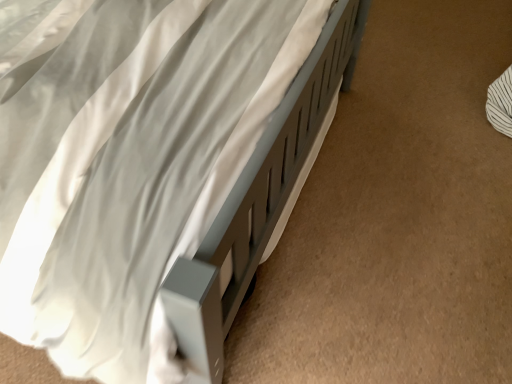
The width and height of the screenshot is (512, 384). What are the coordinates of `satin white bed at center` in the screenshot? It's located at (143, 196).

The height and width of the screenshot is (384, 512). Describe the element at coordinates (143, 196) in the screenshot. I see `satin white bed at center` at that location.

Locate an element on the screen. The image size is (512, 384). satin white bed at center is located at coordinates (143, 196).